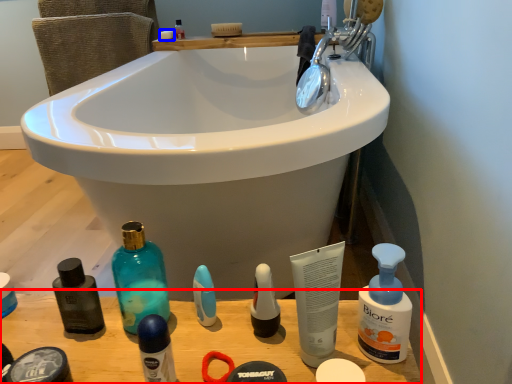
Question: Which object appears closest to the camera in this image, counter top (highlighted by a red box) or soap (highlighted by a blue box)?

Choices:
 (A) counter top
 (B) soap

Answer: (A)